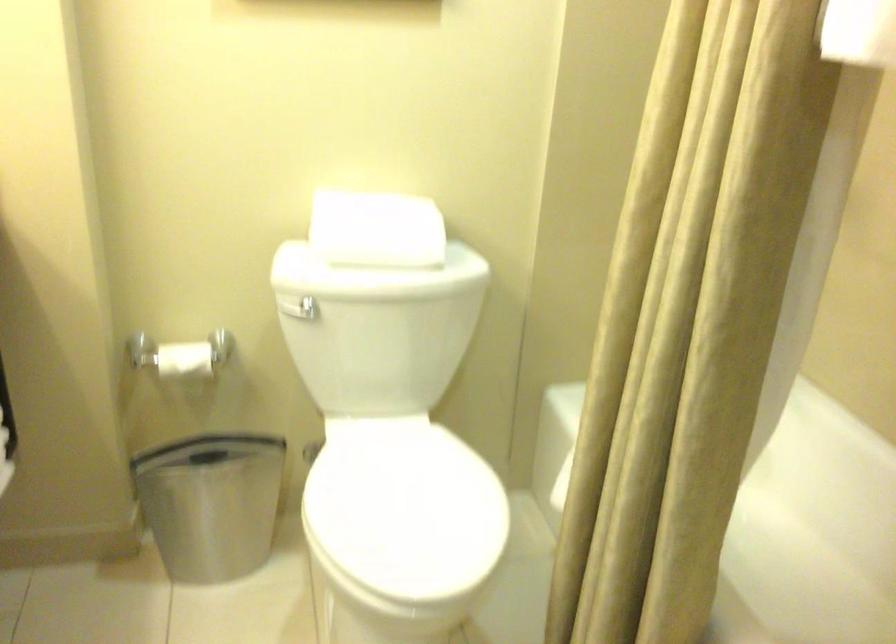
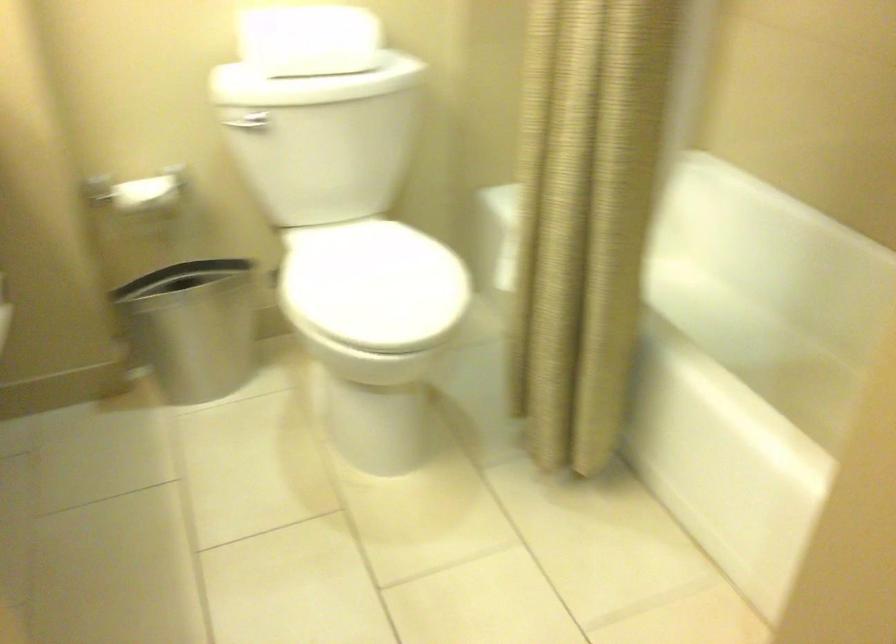
Find the pixel in the second image that matches (x=400, y=509) in the first image.

(372, 285)